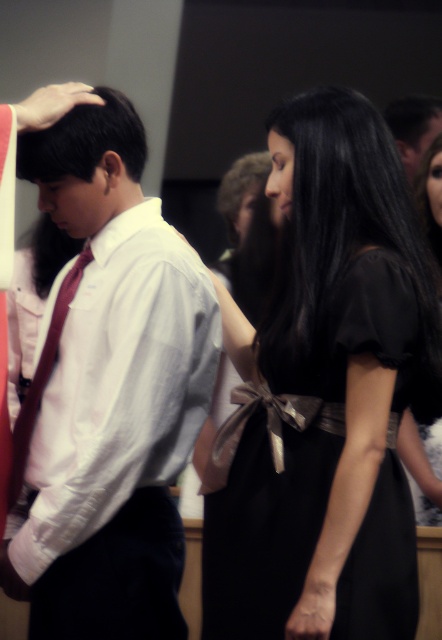
Does black satin dress at center have a larger size compared to matte red tie at center?

Yes.

Does point (275, 426) lie behind point (60, 321)?

That is False.

Who is more forward, (288, 390) or (56, 317)?

Point (288, 390) is more forward.

Where is `black satin dress at center`? The image size is (442, 640). black satin dress at center is located at coordinates (324, 394).

Which is more to the right, white satin shirt at center or matte red tie at center?

white satin shirt at center

Who is lower down, white satin shirt at center or matte red tie at center?

Positioned lower is matte red tie at center.

Between point (72, 609) and point (37, 403), which one is positioned in front?

Point (72, 609)

Locate an element on the screen. white satin shirt at center is located at coordinates (110, 392).

Does shiny black dress at center appear on the right side of matte red tie at center?

Correct, you'll find shiny black dress at center to the right of matte red tie at center.

Is point (433, 500) behind point (53, 342)?

That is True.

The height and width of the screenshot is (640, 442). Find the location of `shiny black dress at center`. shiny black dress at center is located at coordinates (422, 467).